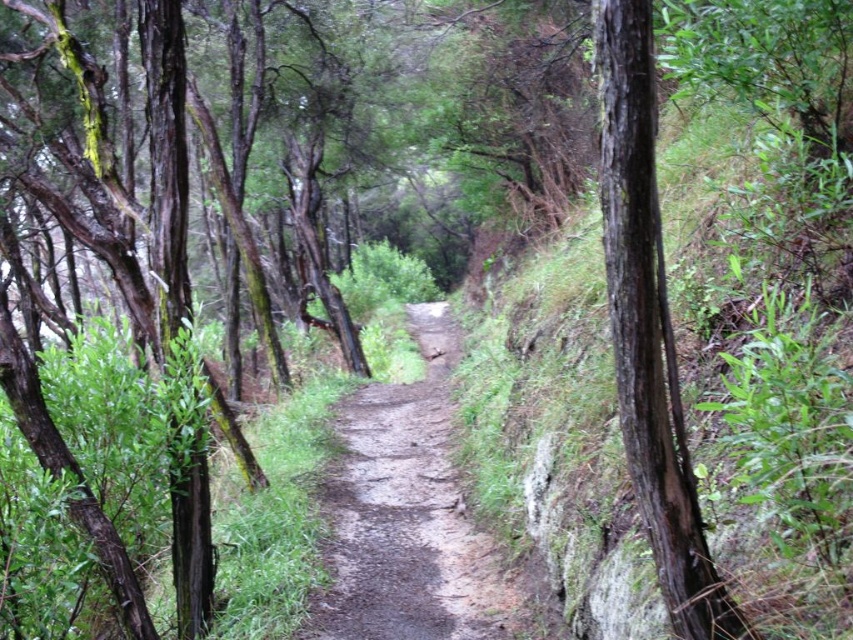
You are a hiker who just arrived at the forest. You see a point marked at coordinates (408, 515). According to the image, what is located at that point?

The point at coordinates (408, 515) indicates damp dirt path at center.

Based on the photo, you are a hiker carrying a backpack and need to pass through the damp dirt path at center. There is a dark brown bark tree at right nearby. Can you estimate if the path is wide enough to allow you to walk comfortably without brushing against the tree?

The damp dirt path at center might be wider than the dark brown bark tree at right, so there is a possibility that the path is wide enough for comfortable passage. However, the uncertainty in the comparison means you should proceed with caution to avoid the tree.